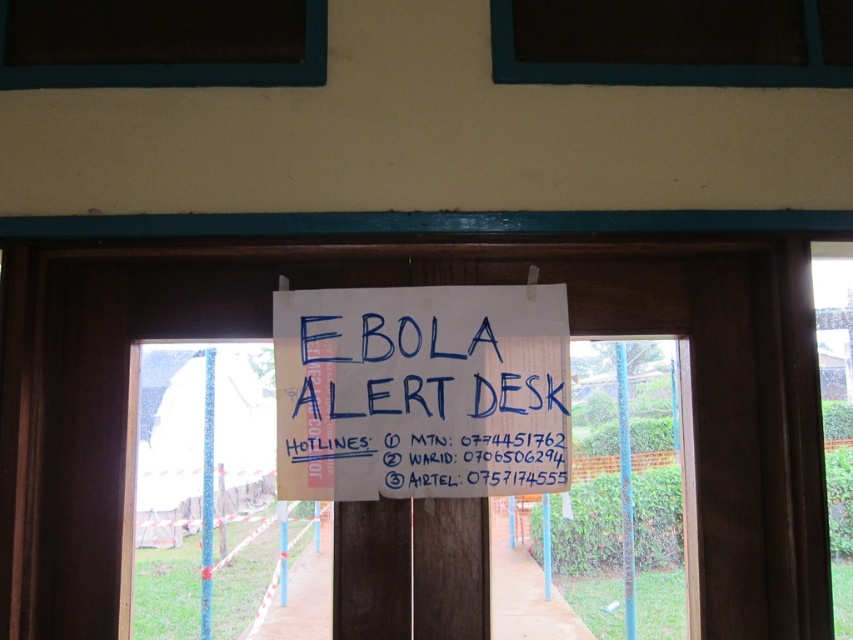
Does blue handwritten sign at center have a greater width compared to dark glass window at upper left?

No, blue handwritten sign at center is not wider than dark glass window at upper left.

Between blue handwritten sign at center and dark glass window at upper left, which one has less height?

dark glass window at upper left is shorter.

Is point (296, 314) farther from viewer compared to point (132, 86)?

That is True.

Where is `blue handwritten sign at center`? The width and height of the screenshot is (853, 640). blue handwritten sign at center is located at coordinates (419, 396).

Does blue handwritten sign at center have a smaller size compared to dark glass window at upper center?

Incorrect, blue handwritten sign at center is not smaller in size than dark glass window at upper center.

Is blue handwritten sign at center bigger than dark glass window at upper center?

Yes, blue handwritten sign at center is bigger than dark glass window at upper center.

The height and width of the screenshot is (640, 853). I want to click on blue handwritten sign at center, so click(x=419, y=396).

From the picture: Is dark glass window at upper center below dark glass window at upper left?

No, dark glass window at upper center is not below dark glass window at upper left.

Who is higher up, dark glass window at upper center or dark glass window at upper left?

dark glass window at upper center is above.

Is point (845, 70) positioned before point (312, 60)?

No, it is behind (312, 60).

The width and height of the screenshot is (853, 640). Find the location of `dark glass window at upper center`. dark glass window at upper center is located at coordinates (663, 64).